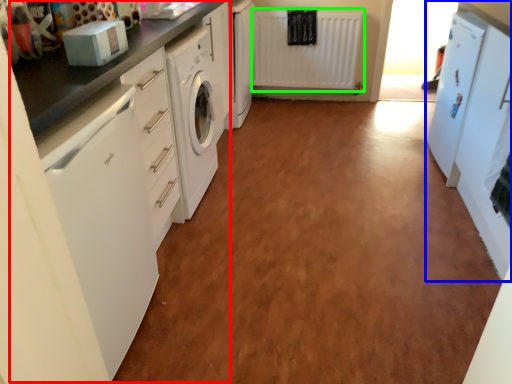
Question: Which object is positioned closest to counter (highlighted by a red box)? Select from cabinetry (highlighted by a blue box) and radiator (highlighted by a green box).

Choices:
 (A) cabinetry
 (B) radiator

Answer: (A)